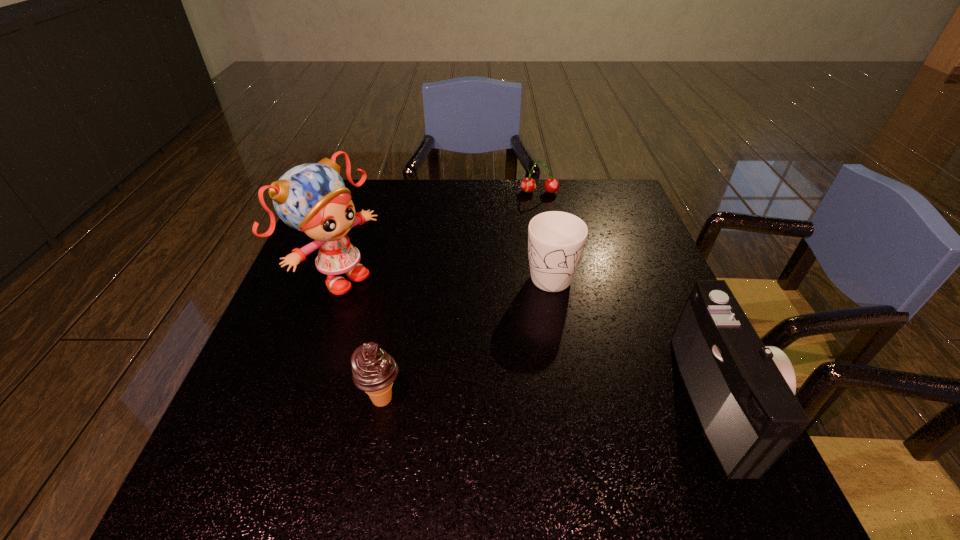
I want to click on blank space located on the side of the mug with the handle, so click(x=566, y=359).

Find the location of a particular element. The width and height of the screenshot is (960, 540). free location located on the face of the tallest object is located at coordinates (473, 363).

Locate an element on the screen. This screenshot has width=960, height=540. blank space located 0.240m on the face of the tallest object is located at coordinates (444, 345).

Find the location of a particular element. blank space located 0.170m on the face of the tallest object is located at coordinates (419, 330).

The width and height of the screenshot is (960, 540). I want to click on free space located with stems pointing upwards on the shortest object, so click(x=542, y=273).

The width and height of the screenshot is (960, 540). Find the location of `free space located 0.210m with stems pointing upwards on the shortest object`. free space located 0.210m with stems pointing upwards on the shortest object is located at coordinates (540, 237).

I want to click on vacant space located with stems pointing upwards on the shortest object, so click(x=542, y=278).

This screenshot has width=960, height=540. I want to click on object that is positioned at the far edge, so point(528,185).

Find the location of a particular element. This screenshot has width=960, height=540. icecream at the near edge is located at coordinates (373, 370).

You are a GUI agent. You are given a task and a screenshot of the screen. Output one action in this format:
    pyautogui.click(x=<x>, y=<y>)
    Task: Click on the camcorder present at the near edge
    This screenshot has height=540, width=960.
    Given the screenshot: What is the action you would take?
    pyautogui.click(x=743, y=393)